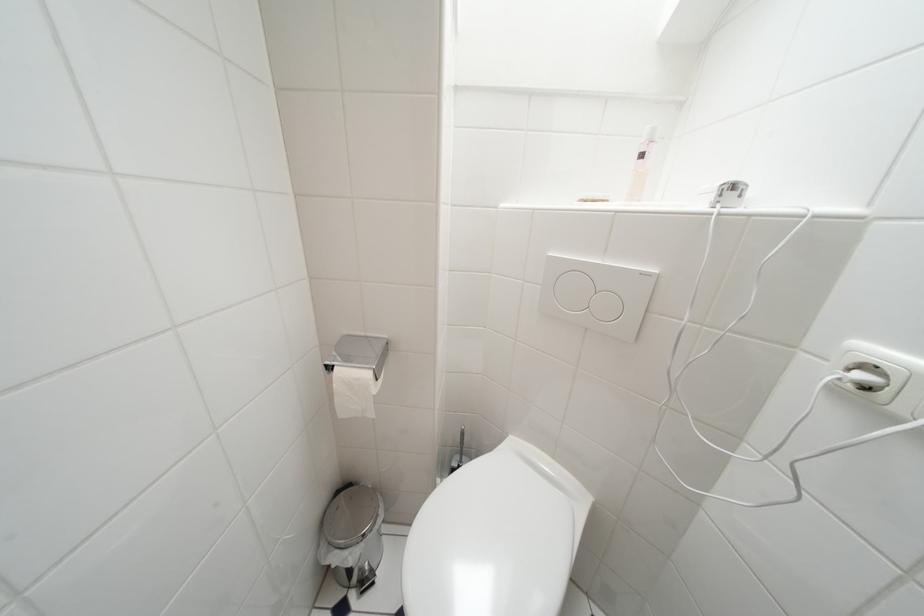
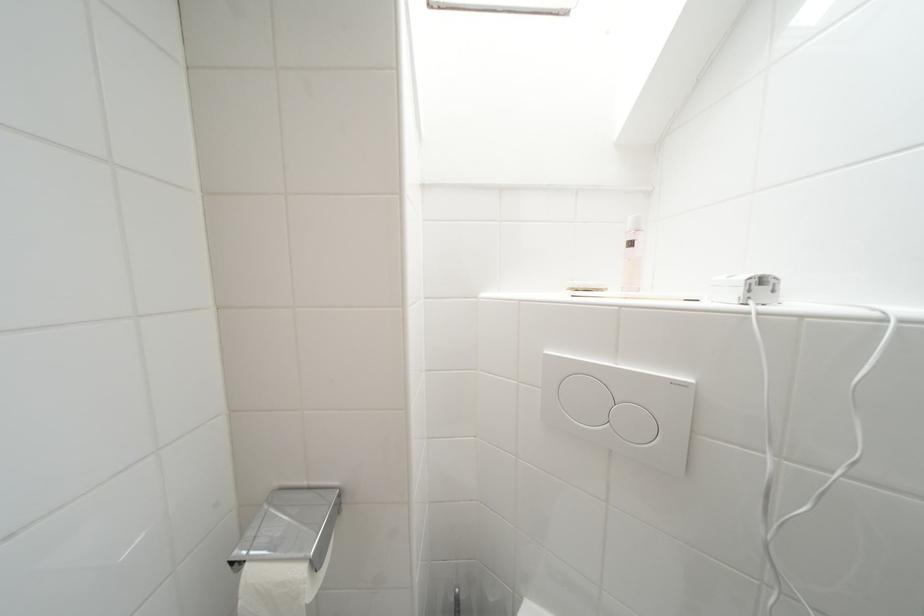
Question: In a continuous first-person perspective shot, in which direction is the camera moving?

Choices:
 (A) Left
 (B) Right
 (C) Forward
 (D) Backward

Answer: (C)